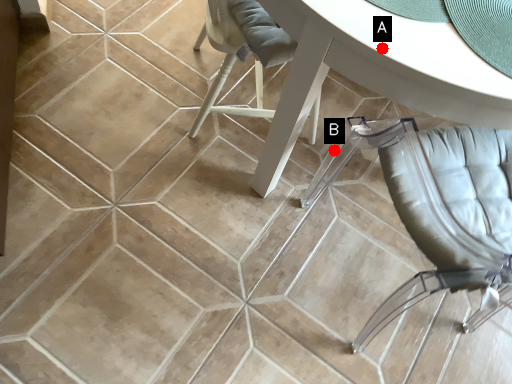
Question: Two points are circled on the image, labeled by A and B beside each circle. Which point appears closest to the camera in this image?

Choices:
 (A) A is closer
 (B) B is closer

Answer: (A)